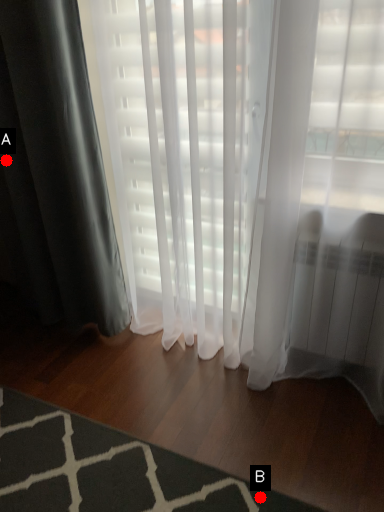
Question: Two points are circled on the image, labeled by A and B beside each circle. Which of the following is the closest to the observer?

Choices:
 (A) A is closer
 (B) B is closer

Answer: (B)